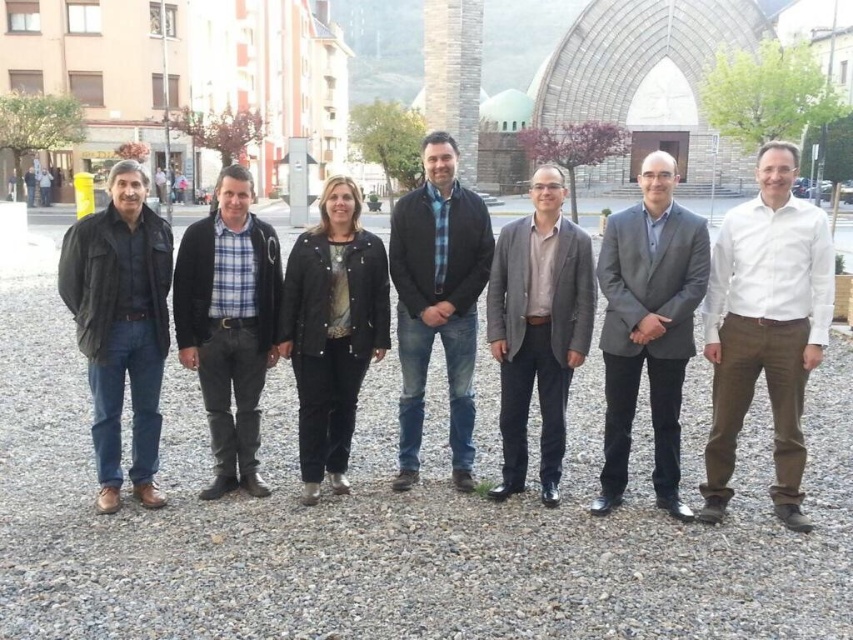
Question: Can you confirm if white cotton shirt at center is bigger than gray suit at center?

Choices:
 (A) yes
 (B) no

Answer: (A)

Question: Which of the following is the closest to the observer?

Choices:
 (A) white cotton shirt at center
 (B) black leather jacket at center
 (C) gray matte blazer at center
 (D) black leather jacket at left

Answer: (A)

Question: Which of these objects is positioned farthest from the gray suit at center?

Choices:
 (A) black leather jacket at left
 (B) denim jeans at center
 (C) white cotton shirt at center
 (D) gray matte blazer at center

Answer: (A)

Question: Is black leather jacket at left to the left of black leather jacket at center from the viewer's perspective?

Choices:
 (A) no
 (B) yes

Answer: (B)

Question: Which object is the farthest from the gray suit at center?

Choices:
 (A) black leather jacket at left
 (B) denim jeans at center

Answer: (A)

Question: Is white cotton shirt at center to the left of gray matte blazer at center from the viewer's perspective?

Choices:
 (A) yes
 (B) no

Answer: (B)